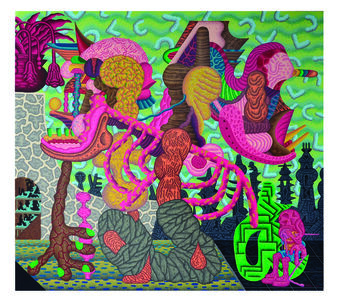
Where is `lanterns`? This screenshot has width=338, height=299. lanterns is located at coordinates (54, 73), (32, 74).